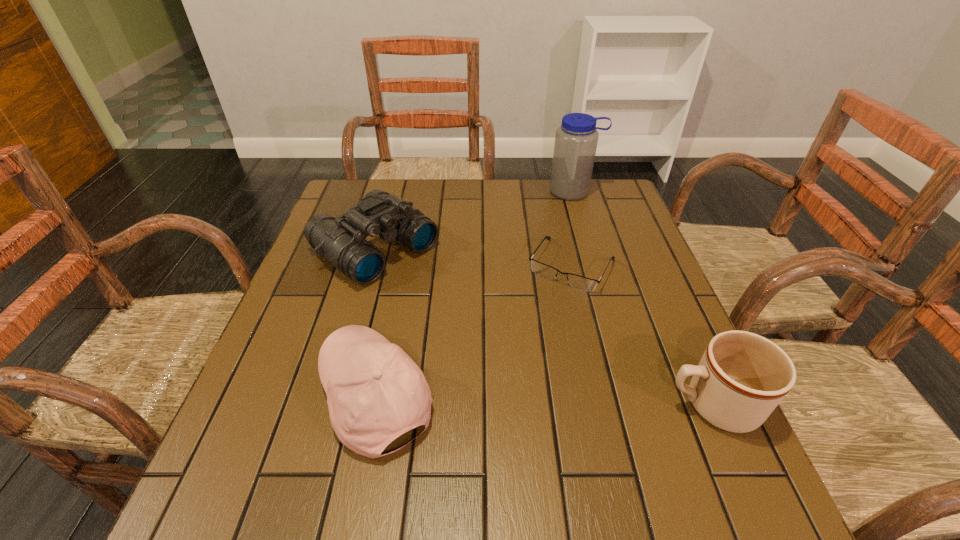
Where is `object situated at the far right corner`? The image size is (960, 540). object situated at the far right corner is located at coordinates (576, 139).

Locate an element on the screen. The image size is (960, 540). object present at the near right corner is located at coordinates (741, 378).

This screenshot has height=540, width=960. What are the coordinates of `vacant space at the far edge` in the screenshot? It's located at (552, 204).

What are the coordinates of `free space at the near edge of the desktop` in the screenshot? It's located at (609, 451).

What are the coordinates of `vacant region at the left edge of the desktop` in the screenshot? It's located at (319, 291).

Identify the location of vacant region at the right edge of the desktop. (661, 276).

This screenshot has height=540, width=960. In the image, there is a desktop. Find the location of `free space at the far left corner`. free space at the far left corner is located at coordinates (392, 184).

Locate an element on the screen. free location at the far right corner is located at coordinates (615, 183).

Identify the location of vacant space in between the shortest object and the tallest object. (573, 228).

Identify the location of vacant area that lies between the mug and the binoculars. The height and width of the screenshot is (540, 960). (543, 327).